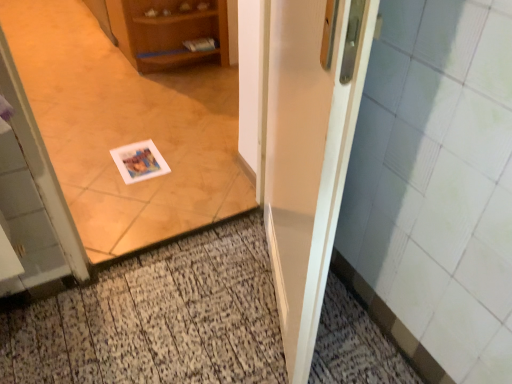
Locate an element on the screen. The image size is (512, 384). space that is in front of white paper postcard at center is located at coordinates (134, 193).